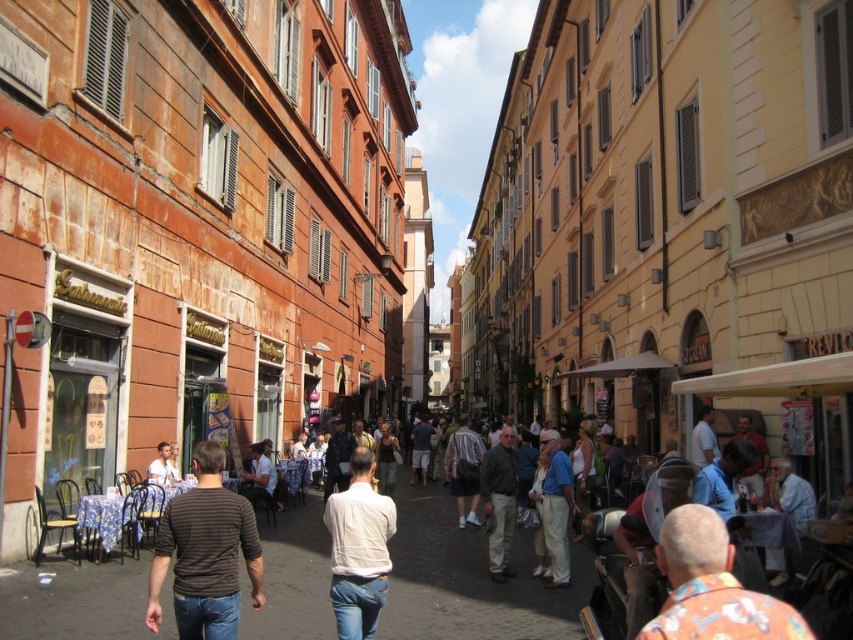
You are a fashion designer observing a street scene with two people wearing shirts. One is wearing a striped cotton shirt at center and the other a white cotton shirt at center. Which shirt is located more to the left in the scene?

The striped cotton shirt at center is positioned on the left side of white cotton shirt at center, so the striped cotton shirt at center is more to the left.

You are standing on the cobblestone street in the European city scene. You notice two points marked in the image. One is at coordinate point (x=218, y=490) and the other at point (x=352, y=586). If you want to reach the point that is closer to you, which coordinate should you head towards?

The point at coordinate (x=218, y=490) is closer to the camera, so you should head towards point (x=218, y=490).

You are a photographer aiming to capture both the striped cotton shirt at center and the white matte shirt at center in a single frame. Given their sizes, which shirt will appear bigger in the photo?

The striped cotton shirt at center will appear bigger in the photo because it has a larger size compared to the white matte shirt at center.